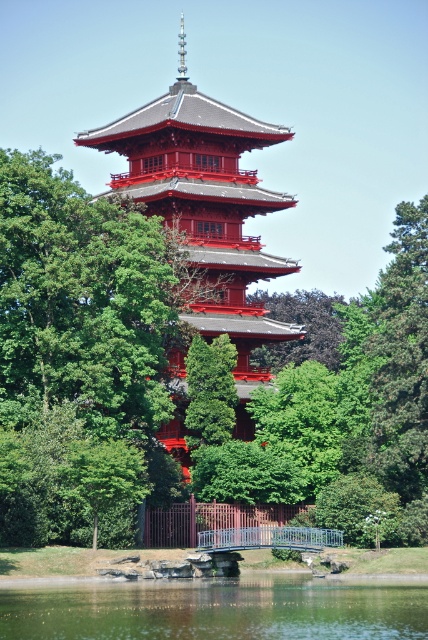
You are standing at the entrance of the pagoda and want to see the reflection of the pagoda in the green reflective water at lower center. Where should you look relative to your current position?

You should look towards the lower center direction since the green reflective water at lower center is located at point (219, 609), which is directly below and slightly to the right of your current position at the entrance.

You are standing at the curved bridge and want to walk towards the pagoda. Which point, point (299, 330) or point (23, 593), is closer to you as you start walking?

Point (23, 593) is closer to you because it is nearer to the camera compared to point (299, 330).

In the scene shown: You are standing on the curved bridge and want to take a photo of the shiny red pagoda at center and the green reflective water at lower center. Which object will appear taller in the photo?

The shiny red pagoda at center will appear taller in the photo because it has a greater height compared to the green reflective water at lower center.